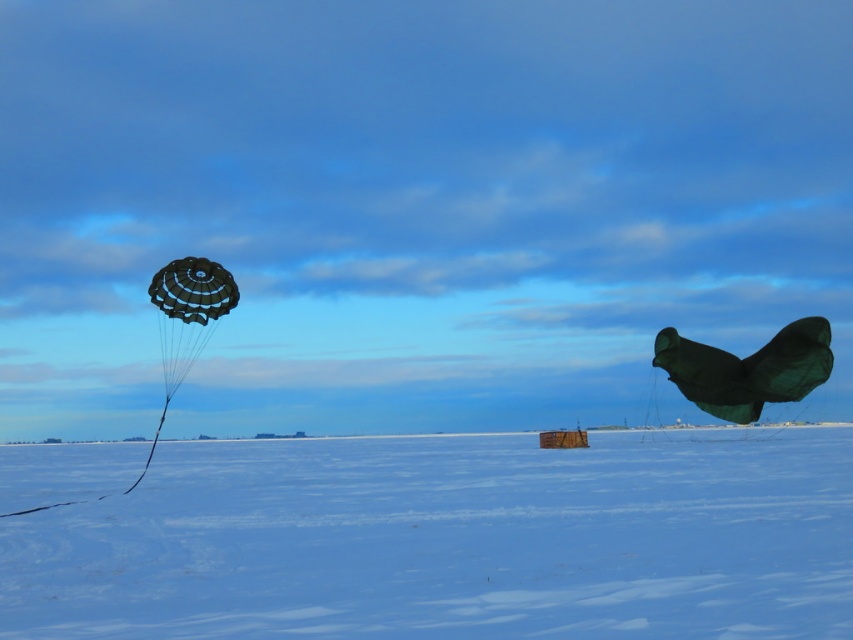
Question: Does green matte kite at right have a lesser width compared to matte black parachute at left?

Choices:
 (A) yes
 (B) no

Answer: (B)

Question: Can you confirm if white matte snow at center is positioned above matte black parachute at left?

Choices:
 (A) no
 (B) yes

Answer: (A)

Question: Is white matte snow at center to the right of green matte kite at right from the viewer's perspective?

Choices:
 (A) no
 (B) yes

Answer: (A)

Question: Which of the following is the farthest from the observer?

Choices:
 (A) (170, 316)
 (B) (805, 324)
 (C) (227, 609)

Answer: (A)

Question: Which object appears closest to the camera in this image?

Choices:
 (A) white matte snow at center
 (B) green matte kite at right

Answer: (A)

Question: Which object is positioned closest to the green matte kite at right?

Choices:
 (A) white matte snow at center
 (B) matte black parachute at left

Answer: (A)